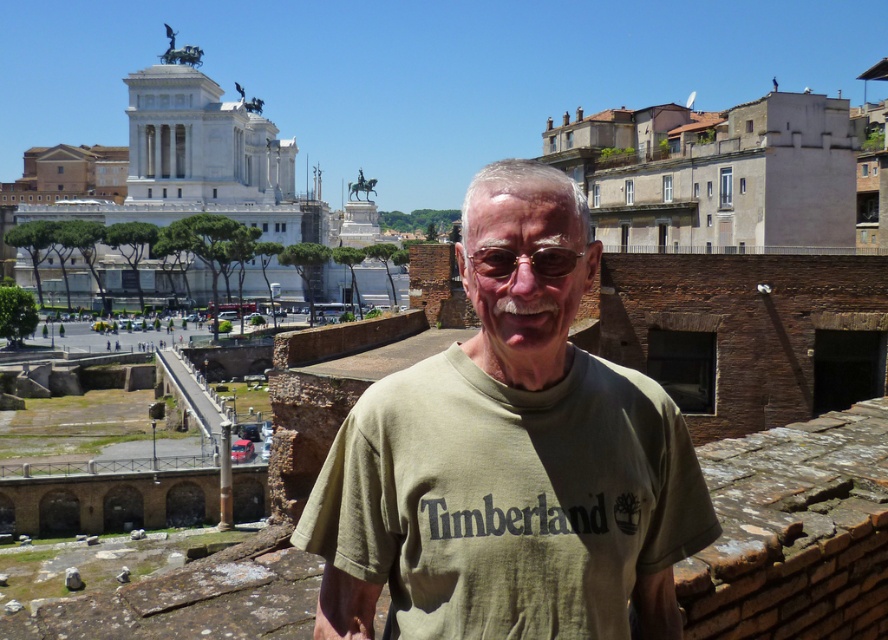
This screenshot has height=640, width=888. What do you see at coordinates (509, 461) in the screenshot?
I see `green cotton shirt at center` at bounding box center [509, 461].

Is point (365, 417) positioned before point (501, 276)?

No, (365, 417) is further to viewer.

Which is behind, point (425, 358) or point (564, 253)?

The point (425, 358) is more distant.

Where is `green cotton shirt at center`? green cotton shirt at center is located at coordinates (509, 461).